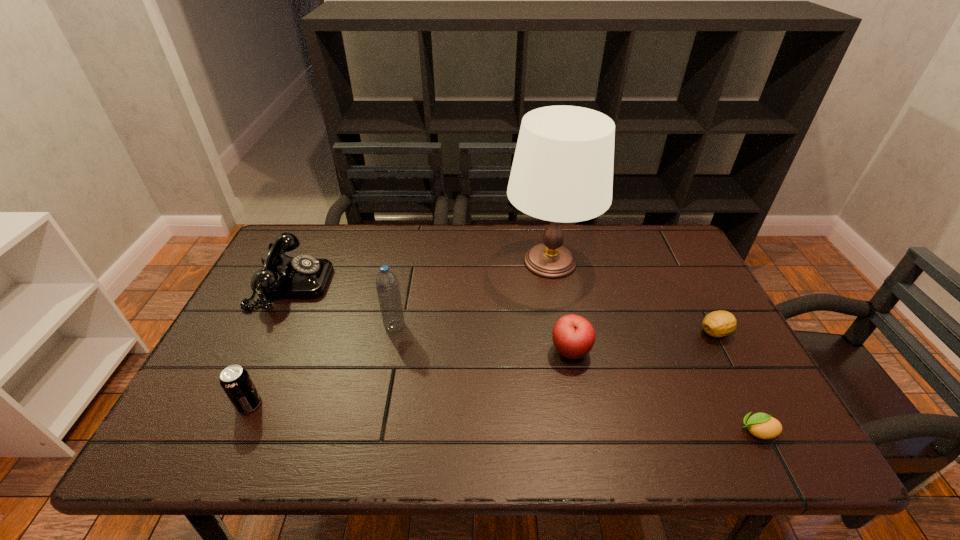
Where is `empty location between the second shortest object and the apple`? empty location between the second shortest object and the apple is located at coordinates (643, 341).

Locate an element on the screen. free space between the soda can and the telephone is located at coordinates (271, 344).

Locate an element on the screen. free space between the nearer lemon and the water bottle is located at coordinates (576, 379).

Locate which object ranks third in proximity to the water bottle. Please provide its 2D coordinates. Your answer should be formatted as a tuple, i.e. [(x, y)], where the tuple contains the x and y coordinates of a point satisfying the conditions above.

[(236, 382)]

Point out which object is positioned as the nearest to the second nearest object. Please provide its 2D coordinates. Your answer should be formatted as a tuple, i.e. [(x, y)], where the tuple contains the x and y coordinates of a point satisfying the conditions above.

[(282, 277)]

Image resolution: width=960 pixels, height=540 pixels. I want to click on vacant space that satisfies the following two spatial constraints: 1. on the dial of the telephone; 2. on the back side of the water bottle, so click(272, 326).

This screenshot has height=540, width=960. Identify the location of free space that satisfies the following two spatial constraints: 1. on the back side of the sixth shortest object; 2. on the dial of the telephone. (403, 284).

Locate an element on the screen. The height and width of the screenshot is (540, 960). free space that satisfies the following two spatial constraints: 1. on the dial of the telephone; 2. on the right side of the third object from left to right is located at coordinates (272, 326).